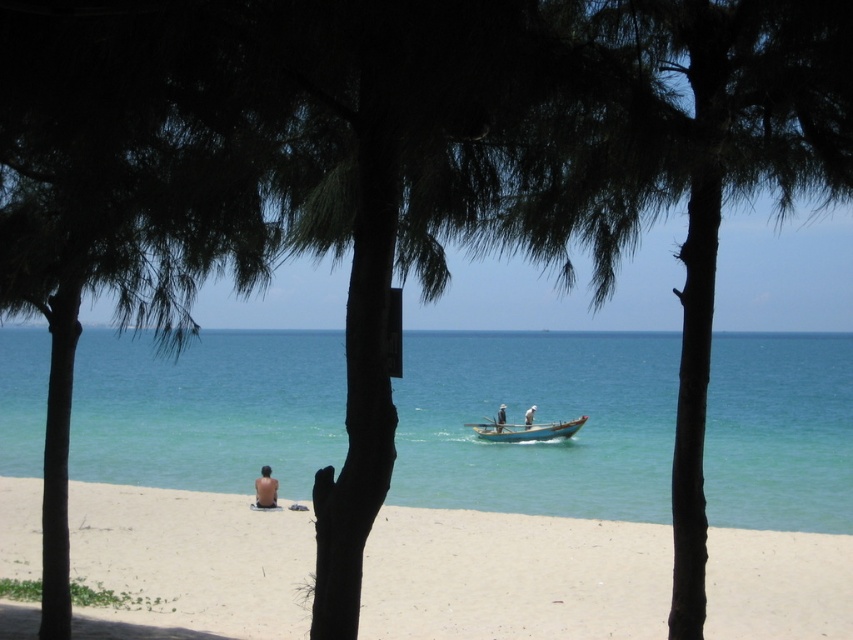
Question: Which object is farther from the camera taking this photo?

Choices:
 (A) white sandy beach at lower center
 (B) dark green bark palm tree at center
 (C) clear blue water at center
 (D) wooden boat at center

Answer: (D)

Question: Among these objects, which one is farthest from the camera?

Choices:
 (A) wooden boat at center
 (B) white sandy beach at lower center
 (C) white matte person at center
 (D) skinny man at lower left

Answer: (C)

Question: Estimate the real-world distances between objects in this image. Which object is closer to the white matte person at center?

Choices:
 (A) white sandy beach at lower center
 (B) white fabric boat at center
 (C) wooden boat at center
 (D) dark green bark palm tree at center

Answer: (B)

Question: Does clear blue water at center come in front of white fabric boat at center?

Choices:
 (A) yes
 (B) no

Answer: (A)

Question: Does white sandy beach at lower center appear on the right side of white fabric boat at center?

Choices:
 (A) yes
 (B) no

Answer: (B)

Question: Does clear blue water at center lie behind white matte person at center?

Choices:
 (A) no
 (B) yes

Answer: (A)